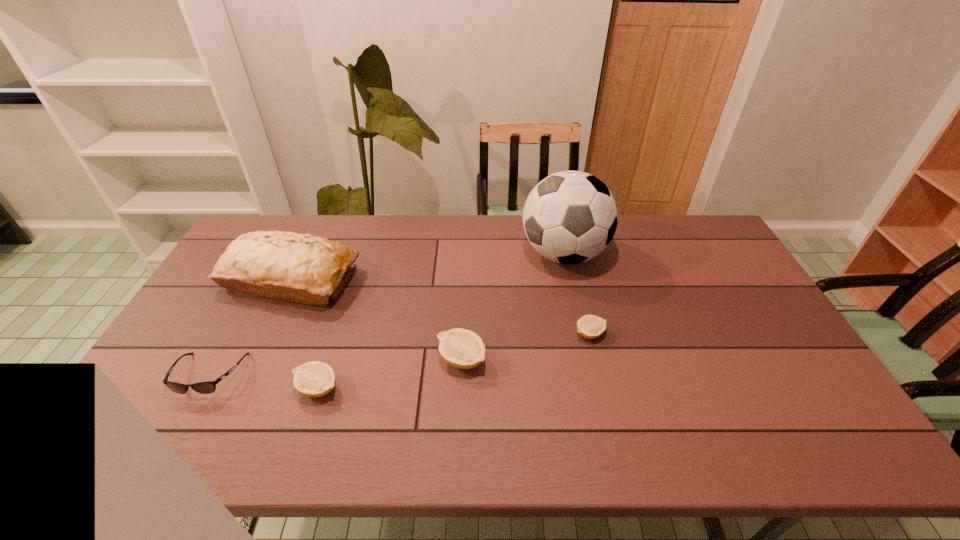
I want to click on vacant space located 0.400m on the left of the shortest lemon, so point(433,334).

Locate an element on the screen. The image size is (960, 540). vacant region located on the main logo of the tallest object is located at coordinates (442, 254).

The image size is (960, 540). Find the location of `vacant region located on the main logo of the tallest object`. vacant region located on the main logo of the tallest object is located at coordinates (424, 254).

At what (x,y) coordinates should I click in order to perform the action: click on vacant space situated on the main logo of the tallest object. Please return your answer as a coordinate pair (x, y). The width and height of the screenshot is (960, 540). Looking at the image, I should click on (457, 254).

Identify the location of free space located on the right of the second tallest object. (468, 279).

Identify the location of soccer ball situated at the far edge. (569, 217).

Image resolution: width=960 pixels, height=540 pixels. In order to click on bread that is at the far edge in this screenshot , I will do `click(288, 266)`.

Locate an element on the screen. lemon situated at the near edge is located at coordinates (313, 379).

Image resolution: width=960 pixels, height=540 pixels. Identify the location of sunglasses located in the near edge section of the desktop. (208, 387).

Find the location of `bread at the left edge`. bread at the left edge is located at coordinates (288, 266).